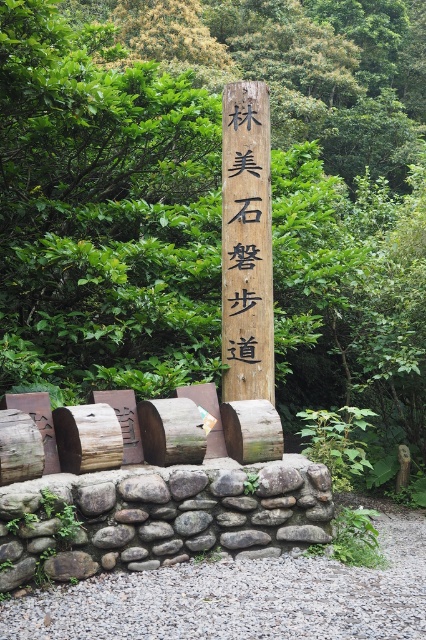
Question: Among these points, which one is nearest to the camera?

Choices:
 (A) (129, 506)
 (B) (259, 346)

Answer: (A)

Question: Which point appears closest to the camera in this image?

Choices:
 (A) (267, 246)
 (B) (224, 500)

Answer: (B)

Question: In this image, where is gray rough stone wall at lower center located relative to wooden signpost at center?

Choices:
 (A) below
 (B) above

Answer: (A)

Question: Is gray rough stone wall at lower center further to camera compared to wooden signpost at center?

Choices:
 (A) yes
 (B) no

Answer: (B)

Question: Where is gray rough stone wall at lower center located in relation to wooden signpost at center in the image?

Choices:
 (A) right
 (B) left

Answer: (B)

Question: Among these points, which one is farthest from the camera?

Choices:
 (A) (229, 497)
 (B) (247, 362)

Answer: (B)